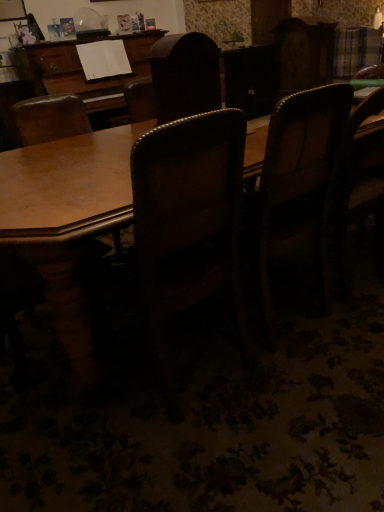
Question: In terms of height, does dark wood chair at right, the second chair positioned from the right, look taller or shorter compared to wooden chair at right, the 1th chair viewed from the right?

Choices:
 (A) short
 (B) tall

Answer: (B)

Question: In the image, is dark wood chair at right, positioned as the third chair in left-to-right order, on the left side or the right side of wooden chair at right, marked as the 4th chair in a left-to-right arrangement?

Choices:
 (A) left
 (B) right

Answer: (A)

Question: Which is nearer to the dark wood chair at center, which appears as the 3th chair when viewed from the right?

Choices:
 (A) dark wood chair at right, positioned as the third chair in left-to-right order
 (B) wooden chair at right, the 1th chair viewed from the right
 (C) wooden chair at center, the first chair positioned from the left
 (D) wooden table at center

Answer: (D)

Question: Which object is positioned closest to the wooden table at center?

Choices:
 (A) wooden chair at right, marked as the 4th chair in a left-to-right arrangement
 (B) dark wood chair at right, the second chair positioned from the right
 (C) dark wood chair at center, which appears as the 3th chair when viewed from the right
 (D) wooden chair at center, the fourth chair in the right-to-left sequence

Answer: (C)